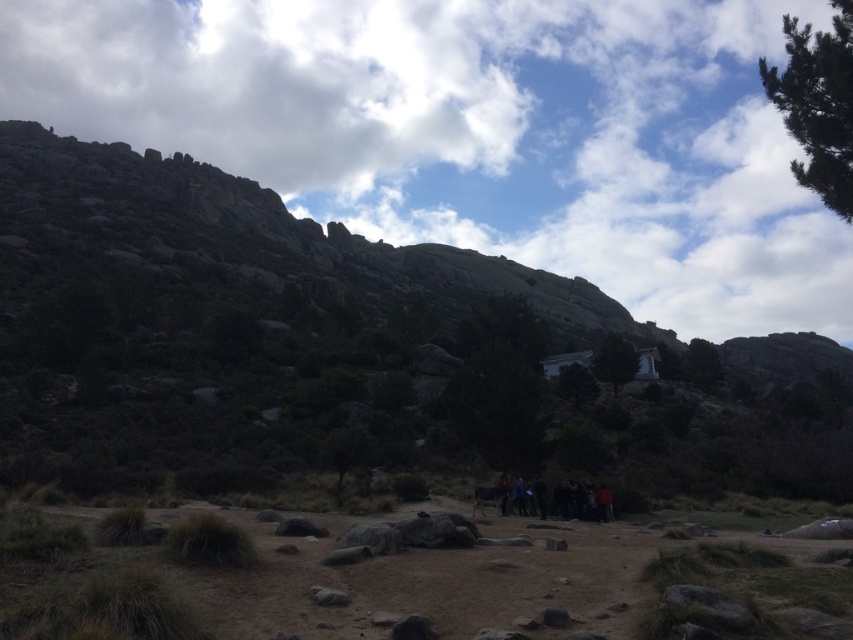
Question: From the image, what is the correct spatial relationship of rocky at center in relation to dark clothing group at center?

Choices:
 (A) above
 (B) below

Answer: (A)

Question: Among these objects, which one is farthest from the camera?

Choices:
 (A) dark clothing group at center
 (B) rocky at center

Answer: (A)

Question: Can you confirm if rocky at center is wider than dark clothing group at center?

Choices:
 (A) no
 (B) yes

Answer: (B)

Question: Among these points, which one is farthest from the camera?

Choices:
 (A) (589, 497)
 (B) (534, 228)
 (C) (677, 465)

Answer: (B)

Question: Which is farther from the dark clothing group at center?

Choices:
 (A) rocky at center
 (B) white fluffy cloud at upper center

Answer: (B)

Question: Observing the image, what is the correct spatial positioning of white fluffy cloud at upper center in reference to dark clothing group at center?

Choices:
 (A) above
 (B) below

Answer: (A)